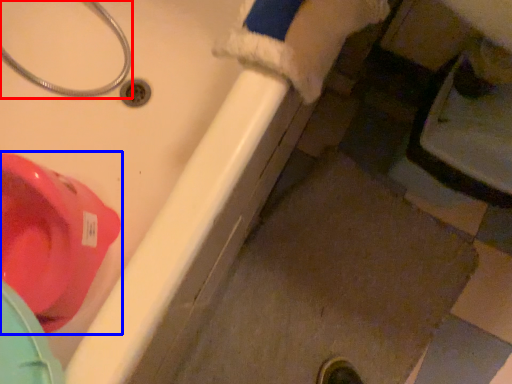
Question: Among these objects, which one is nearest to the camera, plumbing fixture (highlighted by a red box) or toilet (highlighted by a blue box)?

Choices:
 (A) plumbing fixture
 (B) toilet

Answer: (A)